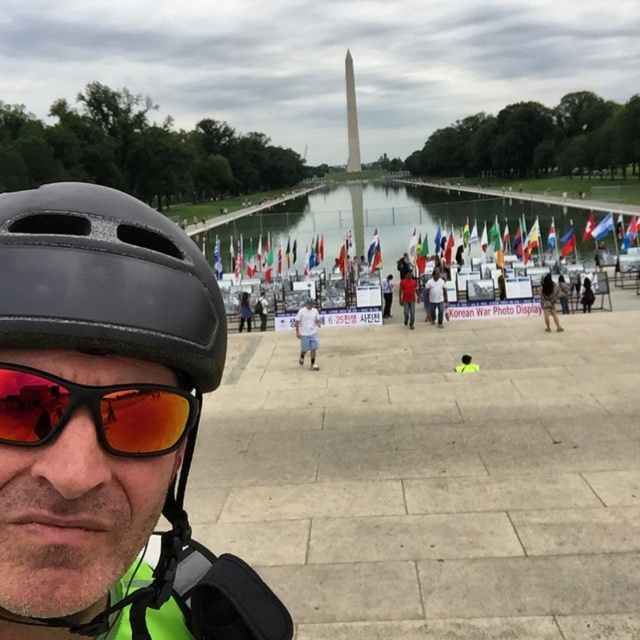
You are standing at the point marked by the coordinates point (307, 332) in the image. What object is located exactly at this coordinate?

The point (307, 332) indicates the white cotton shirt at center.

You are standing at the monument and want to take a photo of the white cotton shirt at center and the blue fabric flag at center. If your camera has a focal length of 50mm, which is best suited for capturing both objects in the same frame, would you need to adjust your position? Explain why based on their distance from you.

The white cotton shirt at center is 12.30 meters away from the blue fabric flag at center. Since the camera with a 50mm focal length has a standard field of view, you might need to step back slightly to ensure both objects are within the frame, as they are separated by over 12 meters.